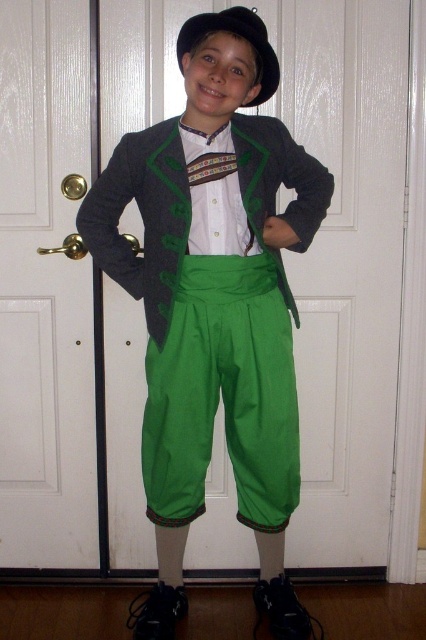
Does point (291, 205) come farther from viewer compared to point (264, 33)?

Yes, it is.

Between dark gray wool jacket at center and black felt hat at upper center, which one has less height?

black felt hat at upper center

The image size is (426, 640). What do you see at coordinates (141, 218) in the screenshot? I see `dark gray wool jacket at center` at bounding box center [141, 218].

Find the location of `dark gray wool jacket at center`. dark gray wool jacket at center is located at coordinates (141, 218).

Which is more to the left, matte green pants at center or black felt hat at upper center?

Positioned to the left is matte green pants at center.

Is matte green pants at center to the left of black felt hat at upper center from the viewer's perspective?

Correct, you'll find matte green pants at center to the left of black felt hat at upper center.

The width and height of the screenshot is (426, 640). Describe the element at coordinates (215, 301) in the screenshot. I see `matte green pants at center` at that location.

At what (x,y) coordinates should I click in order to perform the action: click on matte green pants at center. Please return your answer as a coordinate pair (x, y). Looking at the image, I should click on (215, 301).

Between point (189, 394) and point (244, 147), which one is positioned behind?

The point (189, 394) is more distant.

What do you see at coordinates (215, 301) in the screenshot?
I see `matte green pants at center` at bounding box center [215, 301].

Locate an element on the screen. matte green pants at center is located at coordinates (215, 301).